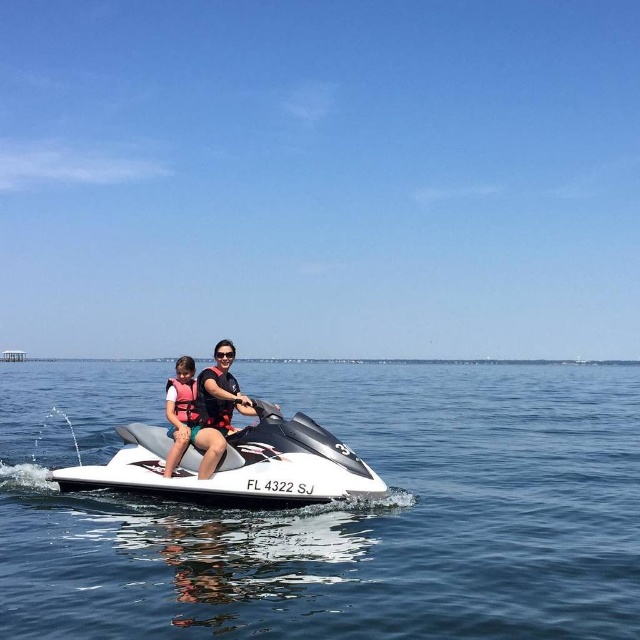
You are planning to take a photo of the clear blue water at center and the white life vest at center from the shore. Which object will appear wider in the photo?

The clear blue water at center will appear wider in the photo since its width is larger than that of the white life vest at center according to the description.

You are a safety inspector checking the jet ski and water conditions. Based on the image, which object is wider, the clear blue water at center or the white glossy jet ski at center?

The clear blue water at center is wider than the white glossy jet ski at center according to the description.